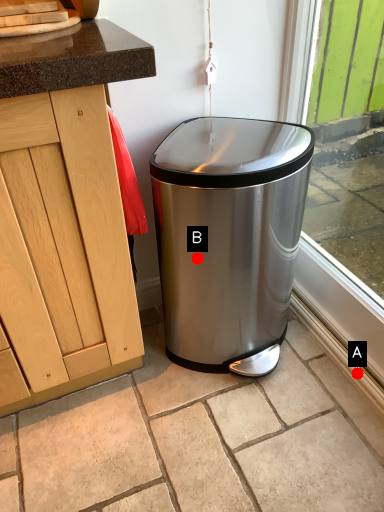
Question: Two points are circled on the image, labeled by A and B beside each circle. Which of the following is the closest to the observer?

Choices:
 (A) A is closer
 (B) B is closer

Answer: (B)